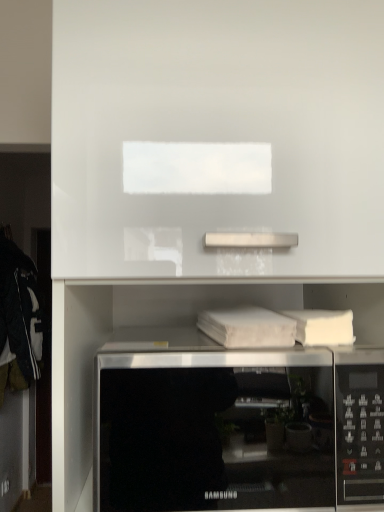
Question: Considering the relative sizes of satin silver microwave at lower center and white glossy cabinet at upper center in the image provided, is satin silver microwave at lower center smaller than white glossy cabinet at upper center?

Choices:
 (A) no
 (B) yes

Answer: (B)

Question: Is satin silver microwave at lower center positioned behind white glossy cabinet at upper center?

Choices:
 (A) no
 (B) yes

Answer: (B)

Question: Are satin silver microwave at lower center and white glossy cabinet at upper center beside each other?

Choices:
 (A) no
 (B) yes

Answer: (A)

Question: Is white glossy cabinet at upper center a part of satin silver microwave at lower center?

Choices:
 (A) yes
 (B) no

Answer: (B)

Question: From the image's perspective, would you say satin silver microwave at lower center is shown under white glossy cabinet at upper center?

Choices:
 (A) no
 (B) yes

Answer: (B)

Question: Considering the positions of white matte book at center and white glossy cabinet at upper center in the image, is white matte book at center taller or shorter than white glossy cabinet at upper center?

Choices:
 (A) tall
 (B) short

Answer: (B)

Question: Is white matte book at center bigger or smaller than white glossy cabinet at upper center?

Choices:
 (A) small
 (B) big

Answer: (A)

Question: Considering the positions of white matte book at center and white glossy cabinet at upper center in the image, is white matte book at center wider or thinner than white glossy cabinet at upper center?

Choices:
 (A) wide
 (B) thin

Answer: (B)

Question: From a real-world perspective, relative to white glossy cabinet at upper center, is white matte book at center vertically above or below?

Choices:
 (A) above
 (B) below

Answer: (B)

Question: Considering the positions of satin silver microwave at lower center and white glossy cabinet at upper center in the image, is satin silver microwave at lower center taller or shorter than white glossy cabinet at upper center?

Choices:
 (A) short
 (B) tall

Answer: (A)

Question: In the image, is satin silver microwave at lower center positioned in front of or behind white glossy cabinet at upper center?

Choices:
 (A) front
 (B) behind

Answer: (B)

Question: Visually, is satin silver microwave at lower center positioned to the left or to the right of white glossy cabinet at upper center?

Choices:
 (A) left
 (B) right

Answer: (B)

Question: From a real-world perspective, is satin silver microwave at lower center positioned above or below white glossy cabinet at upper center?

Choices:
 (A) above
 (B) below

Answer: (B)

Question: Based on their positions, is satin silver microwave at lower center located to the left or right of white matte book at center?

Choices:
 (A) right
 (B) left

Answer: (B)

Question: Is satin silver microwave at lower center taller or shorter than white matte book at center?

Choices:
 (A) short
 (B) tall

Answer: (B)